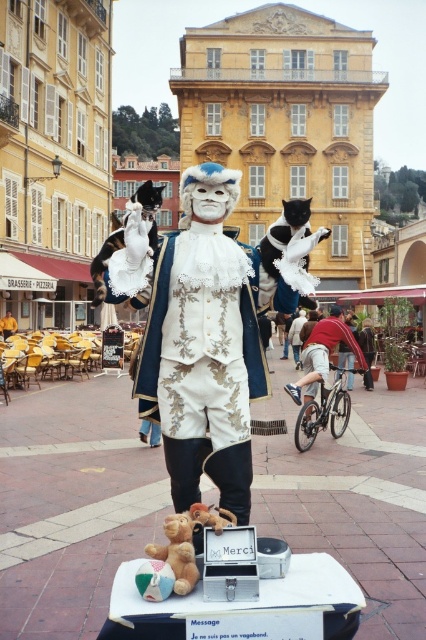
You are a street performer who wants to place a new item on the table in front of the statue. The new item is the size of the brown plush teddy bear at lower center. Can you fit it next to the white lace fabric costume at center without removing anything else?

The white lace fabric costume at center is bigger than the brown plush teddy bear at lower center. Since the new item is the size of the brown plush teddy bear at lower center, there should be enough space to place it next to the white lace fabric costume at center without removing anything else.

You are a photographer positioned at the center of the town square, aiming to capture a photo of the black and white fur cat at center. Given that your camera has a field of view that covers the area from coordinates 0.3 to 0.7 on both the x and y axes, will the cat be fully within the frame?

The black and white fur cat at center is located at point (291, 248), which falls within the camera field of view from 0.3 to 0.7 on both axes. Therefore, the cat will be fully within the frame.

You are a tourist standing in front of the statue in the European town square. You see the white lace fabric costume at center and the brown plush teddy bear at lower center. Which object is positioned higher relative to the other?

The white lace fabric costume at center is above the brown plush teddy bear at lower center, so the white lace fabric costume at center is positioned higher.